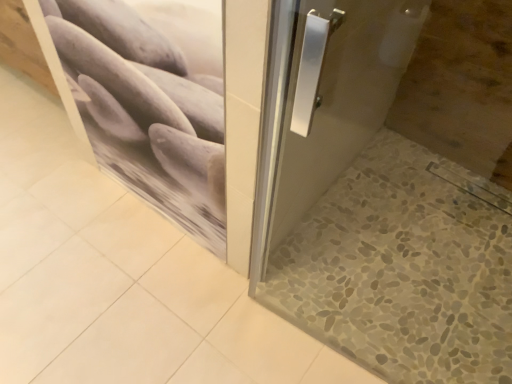
Question: Is matte stone pebble at upper left in contact with gray pebble tile at lower right?

Choices:
 (A) no
 (B) yes

Answer: (A)

Question: Can gray pebble tile at lower right be found inside matte stone pebble at upper left?

Choices:
 (A) no
 (B) yes

Answer: (A)

Question: From the image's perspective, would you say matte stone pebble at upper left is positioned over gray pebble tile at lower right?

Choices:
 (A) no
 (B) yes

Answer: (B)

Question: Does matte stone pebble at upper left have a greater height compared to gray pebble tile at lower right?

Choices:
 (A) no
 (B) yes

Answer: (B)

Question: Can you confirm if matte stone pebble at upper left is positioned to the left of gray pebble tile at lower right?

Choices:
 (A) yes
 (B) no

Answer: (A)

Question: From the image's perspective, is matte stone pebble at upper left beneath gray pebble tile at lower right?

Choices:
 (A) no
 (B) yes

Answer: (A)

Question: Does gray pebble tile at lower right have a larger size compared to matte stone pebble at upper left?

Choices:
 (A) yes
 (B) no

Answer: (A)

Question: Considering the relative sizes of gray pebble tile at lower right and matte stone pebble at upper left in the image provided, is gray pebble tile at lower right wider than matte stone pebble at upper left?

Choices:
 (A) no
 (B) yes

Answer: (B)

Question: Is gray pebble tile at lower right far from matte stone pebble at upper left?

Choices:
 (A) no
 (B) yes

Answer: (A)

Question: Are gray pebble tile at lower right and matte stone pebble at upper left making contact?

Choices:
 (A) yes
 (B) no

Answer: (B)

Question: Is gray pebble tile at lower right to the right of matte stone pebble at upper left from the viewer's perspective?

Choices:
 (A) yes
 (B) no

Answer: (A)

Question: Is gray pebble tile at lower right thinner than matte stone pebble at upper left?

Choices:
 (A) no
 (B) yes

Answer: (A)

Question: Is gray pebble tile at lower right wider or thinner than matte stone pebble at upper left?

Choices:
 (A) thin
 (B) wide

Answer: (B)